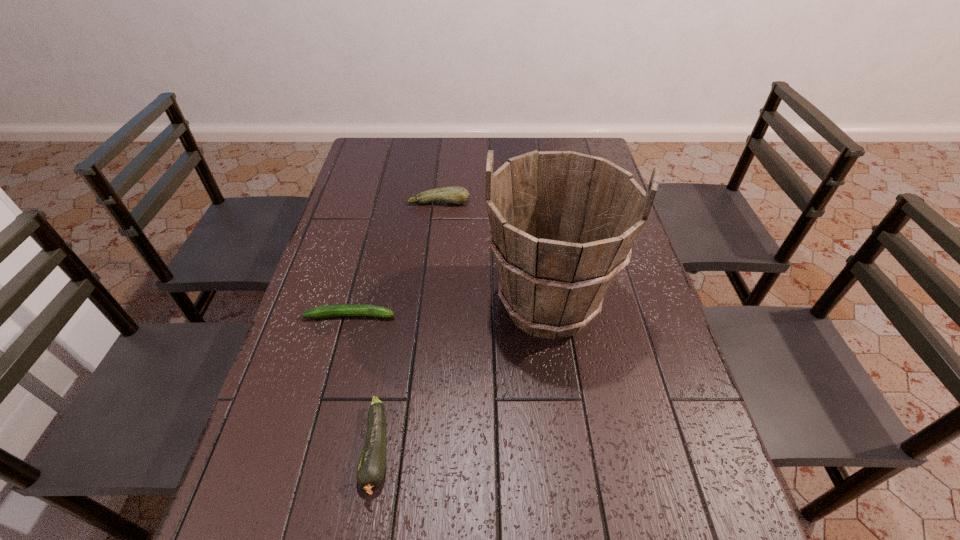
Identify the location of object that is at the right edge. The width and height of the screenshot is (960, 540). (562, 224).

Find the location of `vacant region at the far edge`. vacant region at the far edge is located at coordinates (483, 154).

The image size is (960, 540). In order to click on free point at the left edge in this screenshot , I will do `click(342, 255)`.

Identify the location of free region at the right edge of the desktop. point(666,449).

The height and width of the screenshot is (540, 960). I want to click on unoccupied position between the farthest zucchini and the shortest object, so click(395, 259).

Where is `free space between the rightmost object and the farthest object`? This screenshot has height=540, width=960. free space between the rightmost object and the farthest object is located at coordinates (493, 254).

This screenshot has width=960, height=540. What are the coordinates of `free space between the shortest object and the farthest object` in the screenshot? It's located at (395, 259).

The height and width of the screenshot is (540, 960). I want to click on empty space that is in between the shortest object and the farthest zucchini, so click(x=395, y=259).

The height and width of the screenshot is (540, 960). Identify the location of free space between the nearest object and the farthest object. (408, 326).

At what (x,y) coordinates should I click in order to perform the action: click on free point between the nearest object and the farthest object. Please return your answer as a coordinate pair (x, y). Looking at the image, I should click on (408, 326).